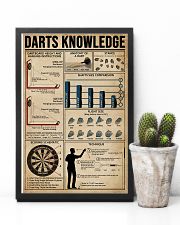
Where is `potted cactus`? The image size is (180, 225). potted cactus is located at coordinates (156, 140).